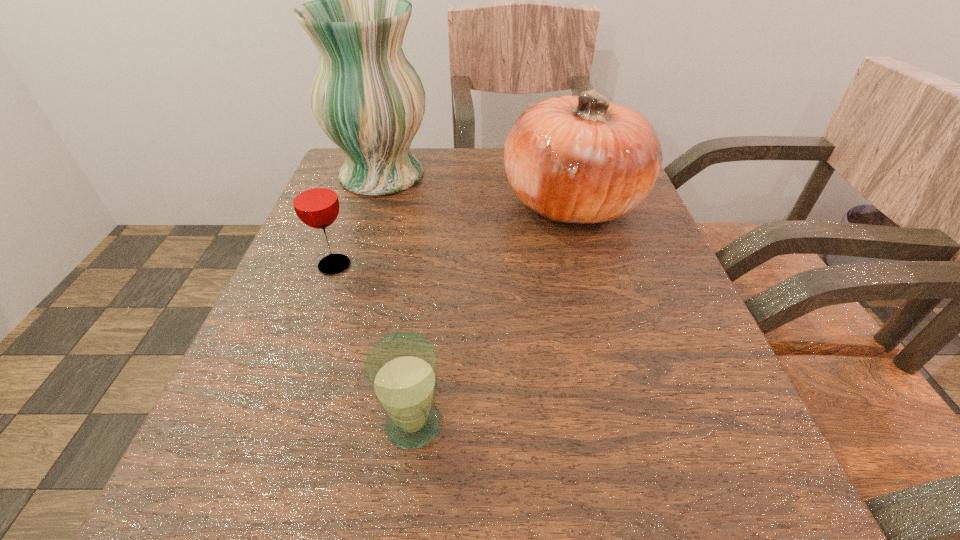
The height and width of the screenshot is (540, 960). I want to click on vase, so click(368, 99).

Identify the location of the rightmost object. The image size is (960, 540). (581, 159).

Where is `pumpkin`? pumpkin is located at coordinates (581, 159).

Where is `the farther glass`? The image size is (960, 540). the farther glass is located at coordinates pos(314,197).

Identify the location of the taller glass. The image size is (960, 540). coord(314,197).

The height and width of the screenshot is (540, 960). I want to click on the right glass, so click(401, 368).

Find the location of a particular element. The height and width of the screenshot is (540, 960). the shorter glass is located at coordinates (401, 368).

Identify the location of vacant space situated 0.130m on the right of the vase. (491, 176).

Find the location of `free space located on the left of the pumpkin`. free space located on the left of the pumpkin is located at coordinates (404, 202).

Identify the location of vacant space located on the back of the taller glass. (355, 208).